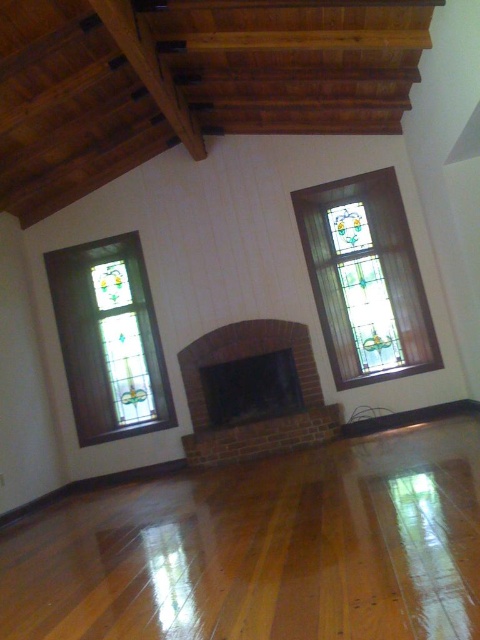
Who is more distant from viewer, (411,362) or (67,259)?

The point (67,259) is behind.

Does stained glass window at center have a greater height compared to stained glass window at left?

No.

Is point (392, 275) closer to camera compared to point (141, 385)?

Yes, it is in front of point (141, 385).

The image size is (480, 640). In order to click on stained glass window at center in this screenshot , I will do `click(365, 278)`.

Can you confirm if stained glass window at center is positioned to the left of brick fireplace at center?

In fact, stained glass window at center is to the right of brick fireplace at center.

Does stained glass window at center appear under brick fireplace at center?

No, stained glass window at center is not below brick fireplace at center.

Image resolution: width=480 pixels, height=640 pixels. Identify the location of stained glass window at center. (365, 278).

Locate an element on the screen. The image size is (480, 640). stained glass window at center is located at coordinates (365, 278).

Is stained glass window at left below brick fireplace at center?

Incorrect, stained glass window at left is not positioned below brick fireplace at center.

Which is behind, point (106, 340) or point (256, 355)?

The point (106, 340) is more distant.

Does point (92, 387) lie behind point (297, 328)?

Yes.

What are the coordinates of `stained glass window at left` in the screenshot? It's located at (108, 339).